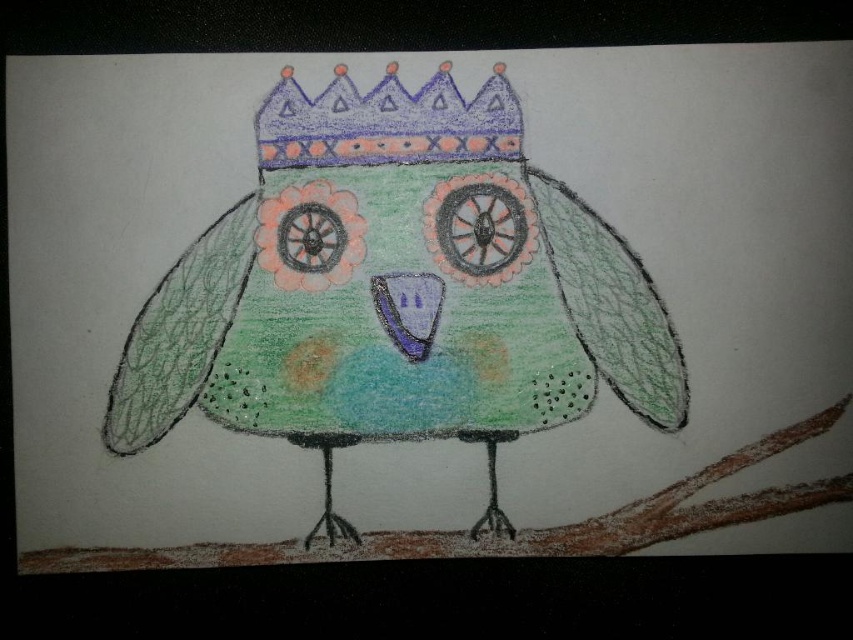
Does pastel green paper bird at center have a greater width compared to purple crayon crown at upper center?

Yes.

Consider the image. Does pastel green paper bird at center have a lesser width compared to purple crayon crown at upper center?

No, pastel green paper bird at center is not thinner than purple crayon crown at upper center.

Where is `pastel green paper bird at center`? This screenshot has height=640, width=853. pastel green paper bird at center is located at coordinates (397, 291).